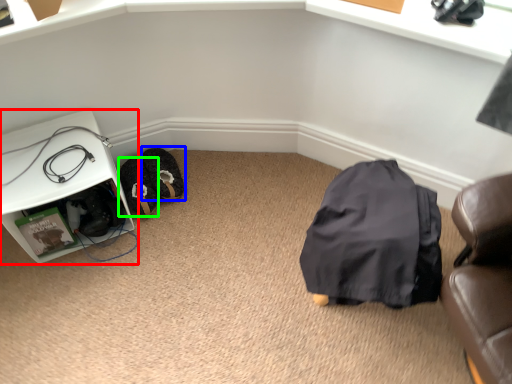
Question: Which object is positioned closest to furniture (highlighted by a red box)? Select from footwear (highlighted by a blue box) and shoe (highlighted by a green box).

Choices:
 (A) footwear
 (B) shoe

Answer: (B)